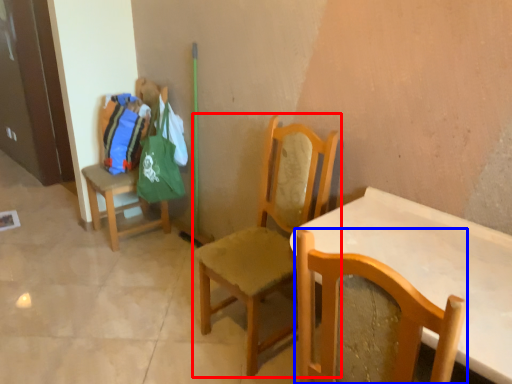
Question: Which object is closer to the camera taking this photo, chair (highlighted by a red box) or chair (highlighted by a blue box)?

Choices:
 (A) chair
 (B) chair

Answer: (B)